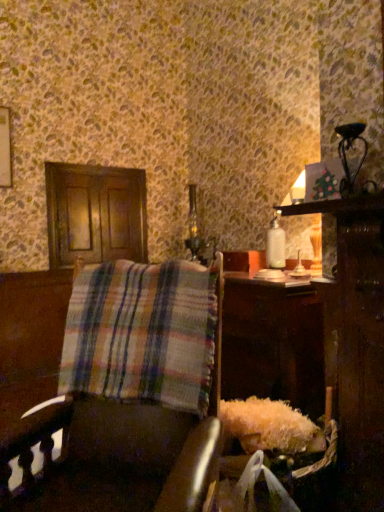
Question: Is metallic silver table lamp at upper right thinner than plaid fabric chair at center?

Choices:
 (A) yes
 (B) no

Answer: (A)

Question: From the image's perspective, would you say metallic silver table lamp at upper right is shown under plaid fabric chair at center?

Choices:
 (A) no
 (B) yes

Answer: (A)

Question: Considering the relative sizes of metallic silver table lamp at upper right and plaid fabric chair at center in the image provided, is metallic silver table lamp at upper right taller than plaid fabric chair at center?

Choices:
 (A) no
 (B) yes

Answer: (A)

Question: Could you tell me if metallic silver table lamp at upper right is facing plaid fabric chair at center?

Choices:
 (A) no
 (B) yes

Answer: (A)

Question: Is plaid fabric chair at center completely or partially inside metallic silver table lamp at upper right?

Choices:
 (A) no
 (B) yes

Answer: (A)

Question: From a real-world perspective, is plaid fabric chair at center physically located above or below plaid fabric at left?

Choices:
 (A) above
 (B) below

Answer: (B)

Question: In terms of size, does plaid fabric chair at center appear bigger or smaller than plaid fabric at left?

Choices:
 (A) big
 (B) small

Answer: (A)

Question: Looking at their shapes, would you say plaid fabric chair at center is wider or thinner than plaid fabric at left?

Choices:
 (A) thin
 (B) wide

Answer: (B)

Question: Is point (69, 480) closer or farther from the camera than point (140, 356)?

Choices:
 (A) farther
 (B) closer

Answer: (B)

Question: Considering the positions of plaid fabric chair at center and metallic silver table lamp at upper right in the image, is plaid fabric chair at center taller or shorter than metallic silver table lamp at upper right?

Choices:
 (A) short
 (B) tall

Answer: (B)

Question: From the image's perspective, is plaid fabric chair at center located above or below metallic silver table lamp at upper right?

Choices:
 (A) below
 (B) above

Answer: (A)

Question: Would you say plaid fabric chair at center is inside or outside metallic silver table lamp at upper right?

Choices:
 (A) inside
 (B) outside

Answer: (B)

Question: In the image, is plaid fabric chair at center positioned in front of or behind metallic silver table lamp at upper right?

Choices:
 (A) front
 (B) behind

Answer: (A)

Question: Considering the positions of plaid fabric at left and metallic silver table lamp at upper right in the image, is plaid fabric at left taller or shorter than metallic silver table lamp at upper right?

Choices:
 (A) tall
 (B) short

Answer: (A)

Question: From the image's perspective, is plaid fabric at left above or below metallic silver table lamp at upper right?

Choices:
 (A) above
 (B) below

Answer: (B)